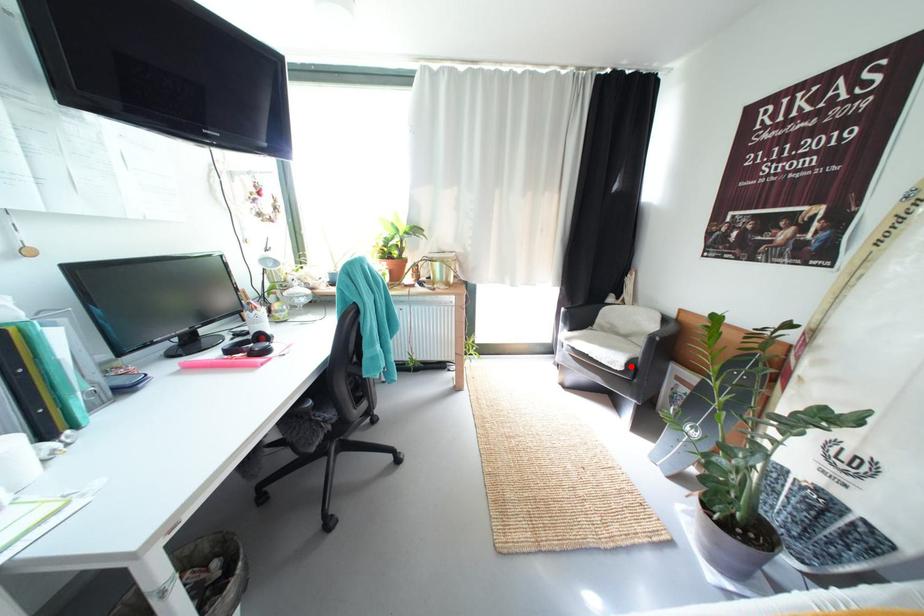
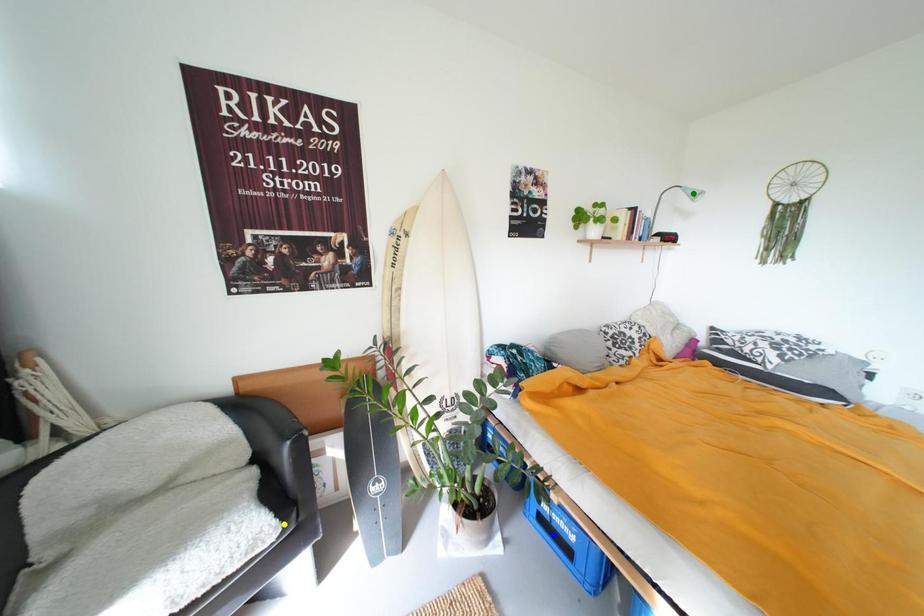
Question: I am providing you with two images of the same scene from different viewpoints. A red point is marked on the first image. You are given multiple points on the second image. Which point in image 2 is actually the same real-world point as the red point in image 1?

Choices:
 (A) yellow point
 (B) blue point
 (C) green point

Answer: (A)